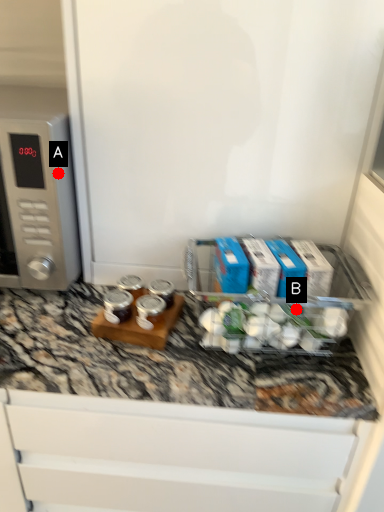
Question: Two points are circled on the image, labeled by A and B beside each circle. Among these points, which one is farthest from the camera?

Choices:
 (A) A is further
 (B) B is further

Answer: (A)